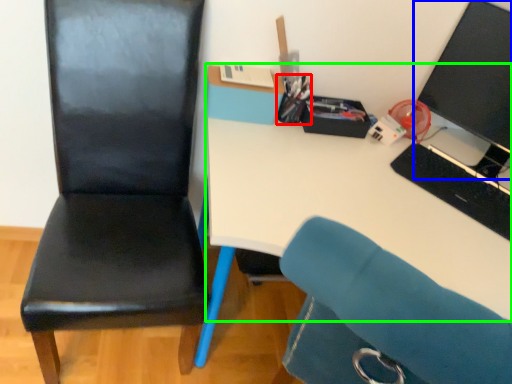
Question: Based on their relative distances, which object is nearer to stationery (highlighted by a red box)? Choose from computer monitor (highlighted by a blue box) and desk (highlighted by a green box).

Choices:
 (A) computer monitor
 (B) desk

Answer: (B)